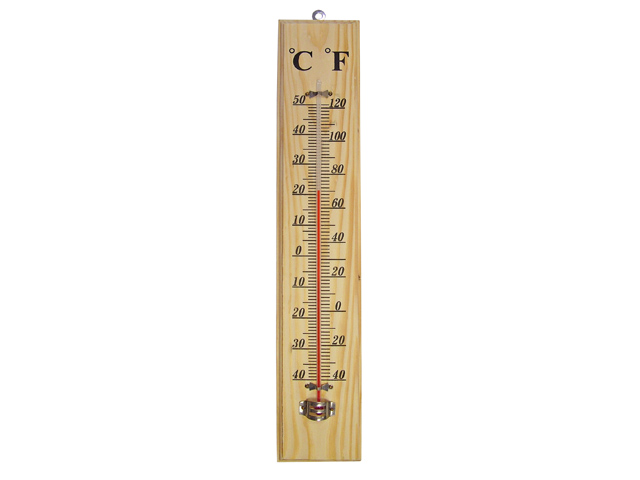
The width and height of the screenshot is (640, 480). Find the location of `wood board`. wood board is located at coordinates pos(354,440).